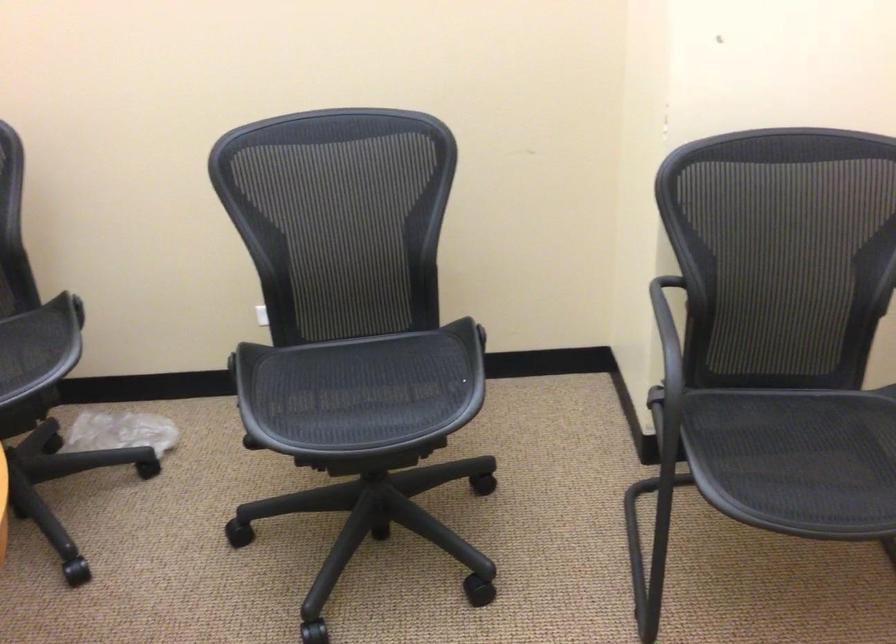
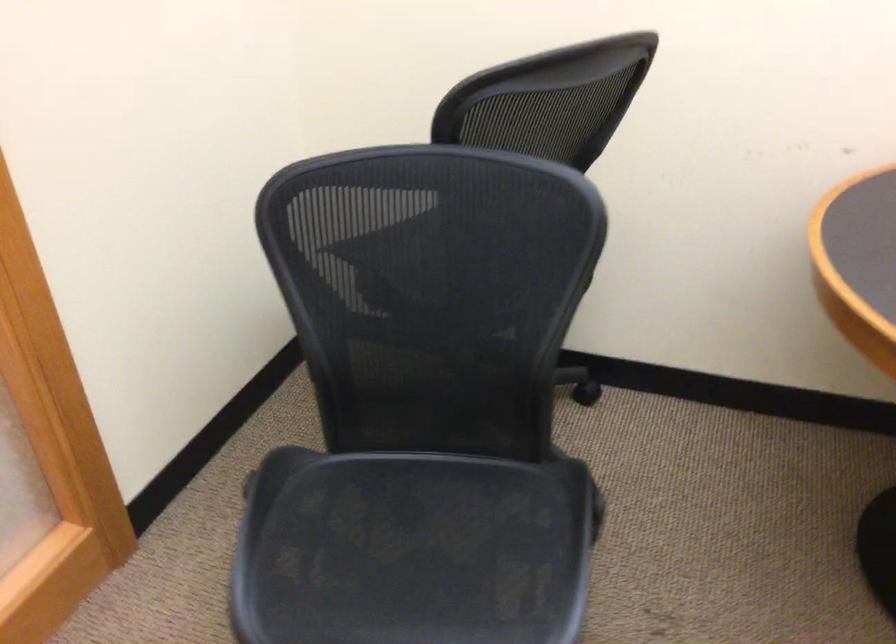
The first image is from the beginning of the video and the second image is from the end. How did the camera likely rotate when shooting the video?

The rotation direction of the camera is left-down.